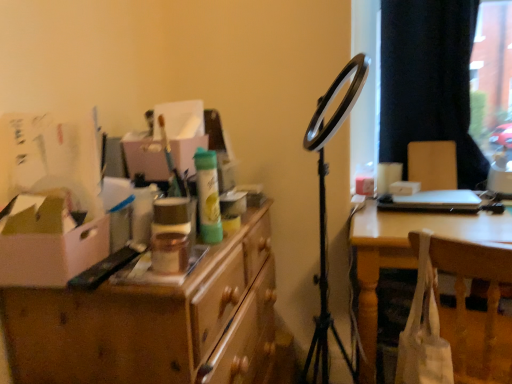
Question: Does black fabric curtain at upper right appear on the left side of wooden desk at left?

Choices:
 (A) no
 (B) yes

Answer: (A)

Question: Can you see black fabric curtain at upper right touching wooden desk at left?

Choices:
 (A) yes
 (B) no

Answer: (B)

Question: Can you confirm if black fabric curtain at upper right is shorter than wooden desk at left?

Choices:
 (A) yes
 (B) no

Answer: (B)

Question: Does black fabric curtain at upper right have a smaller size compared to wooden desk at left?

Choices:
 (A) yes
 (B) no

Answer: (A)

Question: Is black fabric curtain at upper right positioned far away from wooden desk at left?

Choices:
 (A) no
 (B) yes

Answer: (B)

Question: Is black fabric curtain at upper right facing away from wooden desk at left?

Choices:
 (A) no
 (B) yes

Answer: (A)

Question: From the image's perspective, does white fabric bag at lower right appear higher than white cardboard box at left?

Choices:
 (A) yes
 (B) no

Answer: (B)

Question: Is white fabric bag at lower right smaller than white cardboard box at left?

Choices:
 (A) yes
 (B) no

Answer: (B)

Question: Could you tell me if white fabric bag at lower right is turned towards white cardboard box at left?

Choices:
 (A) no
 (B) yes

Answer: (A)

Question: From the image's perspective, is white fabric bag at lower right below white cardboard box at left?

Choices:
 (A) no
 (B) yes

Answer: (B)

Question: Are white fabric bag at lower right and white cardboard box at left beside each other?

Choices:
 (A) no
 (B) yes

Answer: (A)

Question: Can you confirm if white fabric bag at lower right is shorter than white cardboard box at left?

Choices:
 (A) yes
 (B) no

Answer: (B)

Question: Is wooden chair at right further to the viewer compared to white cardboard box at left?

Choices:
 (A) yes
 (B) no

Answer: (A)